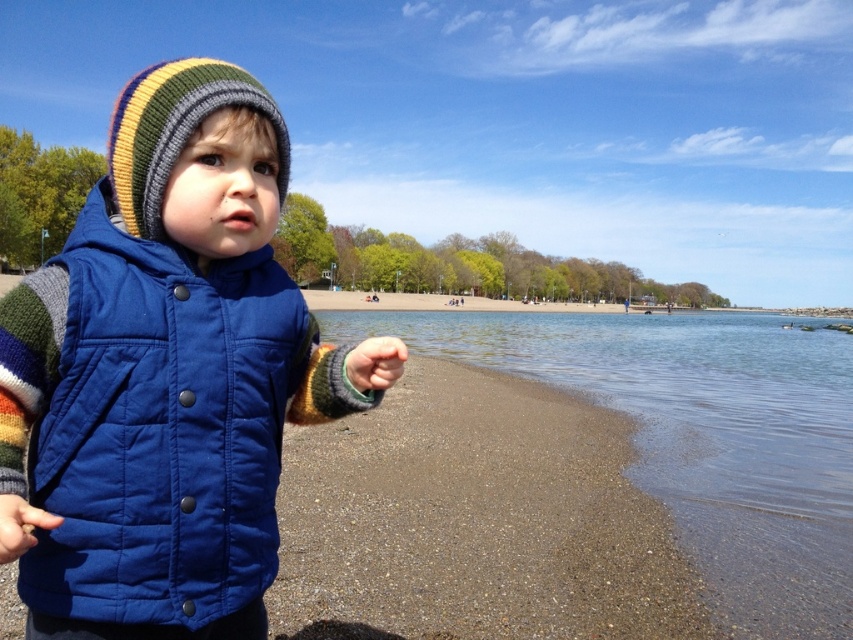
Question: Is clear water at lower right bigger than green fuzzy glove at lower left?

Choices:
 (A) no
 (B) yes

Answer: (B)

Question: Can you confirm if clear water at lower right is positioned above knitted woolen hat at upper left?

Choices:
 (A) yes
 (B) no

Answer: (B)

Question: Considering the real-world distances, which object is closest to the green fuzzy glove at lower left?

Choices:
 (A) clear water at lower right
 (B) navy blue quilted vest at center
 (C) blue quilted vest at lower left
 (D) knitted woolen hat at upper left

Answer: (B)

Question: Which point appears closest to the camera in this image?

Choices:
 (A) (363, 374)
 (B) (730, 403)
 (C) (4, 541)

Answer: (C)

Question: In this image, where is clear water at lower right located relative to blue quilted vest at lower left?

Choices:
 (A) right
 (B) left

Answer: (A)

Question: Considering the real-world distances, which object is farthest from the navy blue quilted vest at center?

Choices:
 (A) knitted woolen hat at upper left
 (B) blue quilted vest at lower left

Answer: (A)